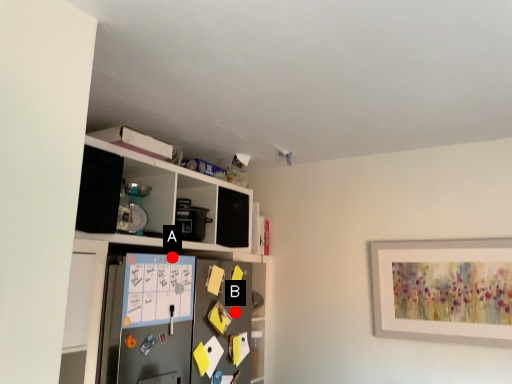
Question: Two points are circled on the image, labeled by A and B beside each circle. Which point is further to the camera?

Choices:
 (A) A is further
 (B) B is further

Answer: (B)